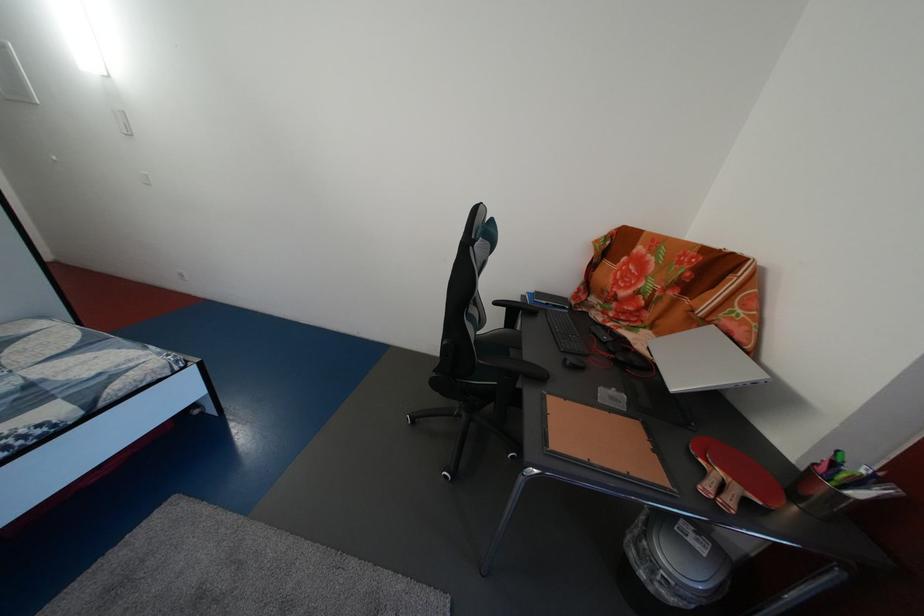
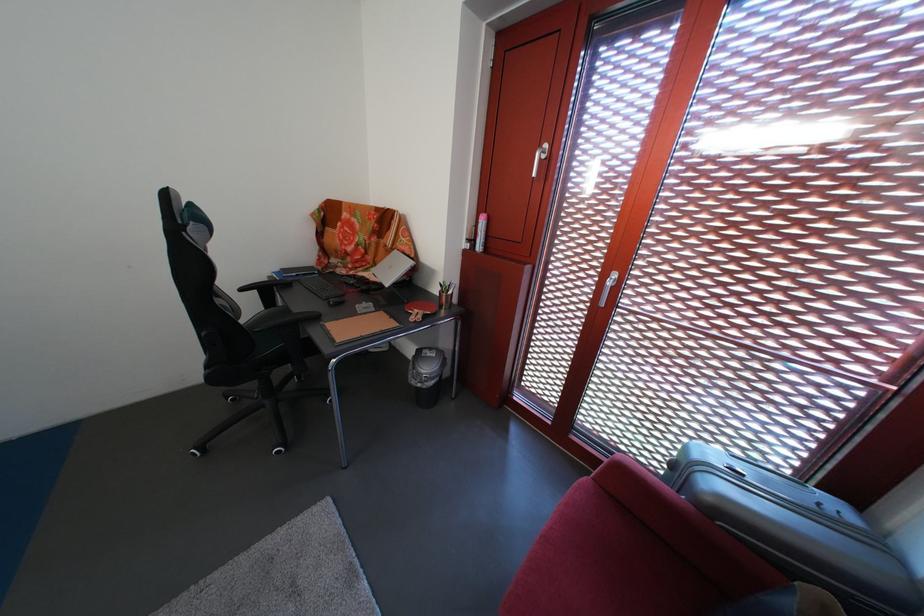
In the second image, find the point that corresponds to [642,560] in the first image.

(424, 389)